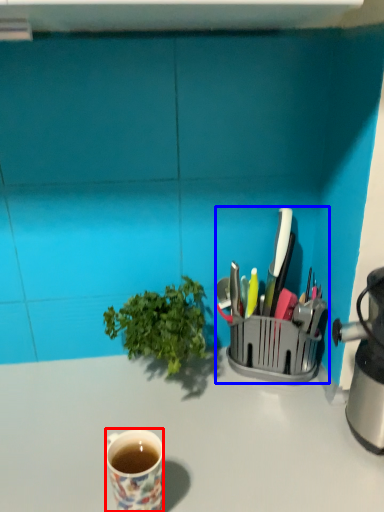
Question: Which object appears farthest to the camera in this image, coffee cup (highlighted by a red box) or appliance (highlighted by a blue box)?

Choices:
 (A) coffee cup
 (B) appliance

Answer: (B)